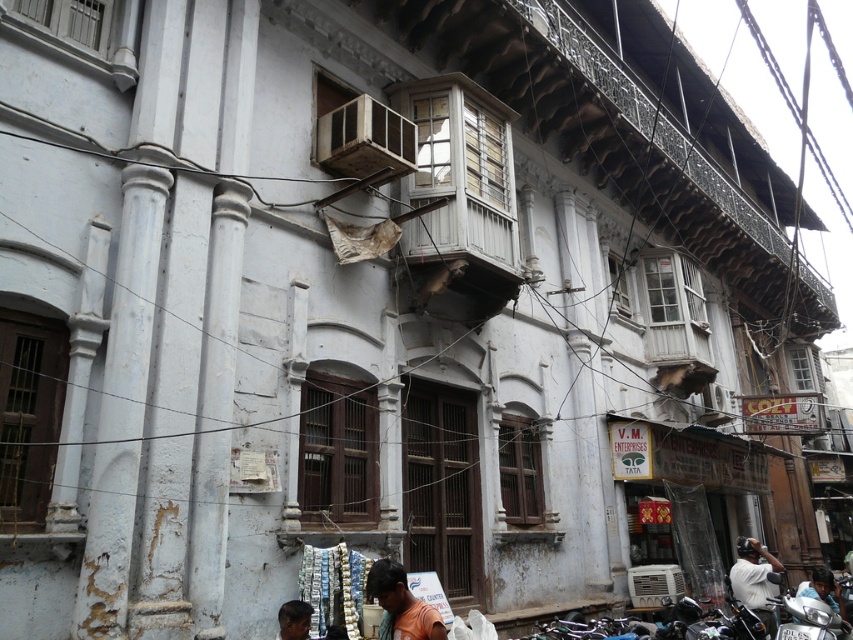
Question: From the image, what is the correct spatial relationship of orange cotton shirt at lower center in relation to dark gray shirt at lower right?

Choices:
 (A) above
 (B) below

Answer: (A)

Question: Does silver metallic motorcycle at lower right come in front of orange t-shirt at lower right?

Choices:
 (A) no
 (B) yes

Answer: (B)

Question: Which of the following is the closest to the observer?

Choices:
 (A) (384, 573)
 (B) (808, 586)

Answer: (A)

Question: Observing the image, what is the correct spatial positioning of dark gray shirt at lower right in reference to orange t-shirt at lower right?

Choices:
 (A) above
 (B) below

Answer: (B)

Question: Based on their relative distances, which object is farther from the dark gray shirt at lower right?

Choices:
 (A) orange cotton shirt at lower center
 (B) silver metallic motorcycle at lower right
 (C) dark brown skin at lower center

Answer: (C)

Question: Which of the following is the closest to the observer?

Choices:
 (A) silver metallic motorcycle at lower right
 (B) dark brown skin at lower center
 (C) dark gray shirt at lower right

Answer: (B)